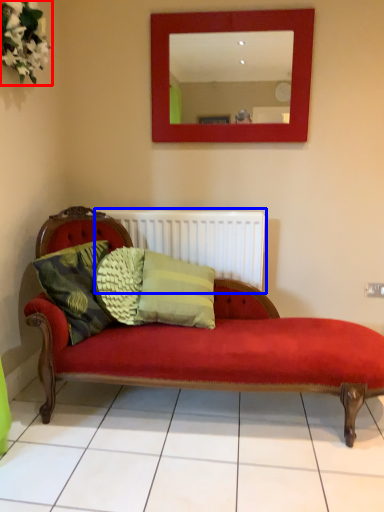
Question: Which of the following is the closest to the observer, floral arrangement (highlighted by a red box) or radiator (highlighted by a blue box)?

Choices:
 (A) floral arrangement
 (B) radiator

Answer: (A)